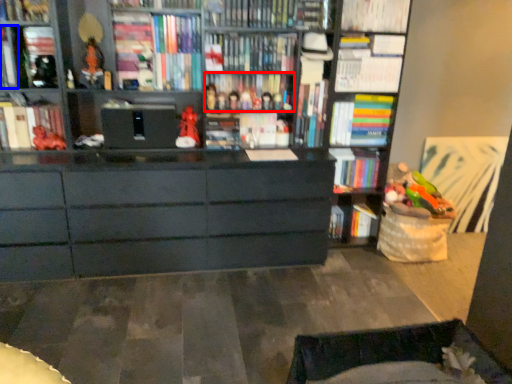
Question: Which object appears farthest to the camera in this image, book (highlighted by a red box) or book (highlighted by a blue box)?

Choices:
 (A) book
 (B) book

Answer: (A)